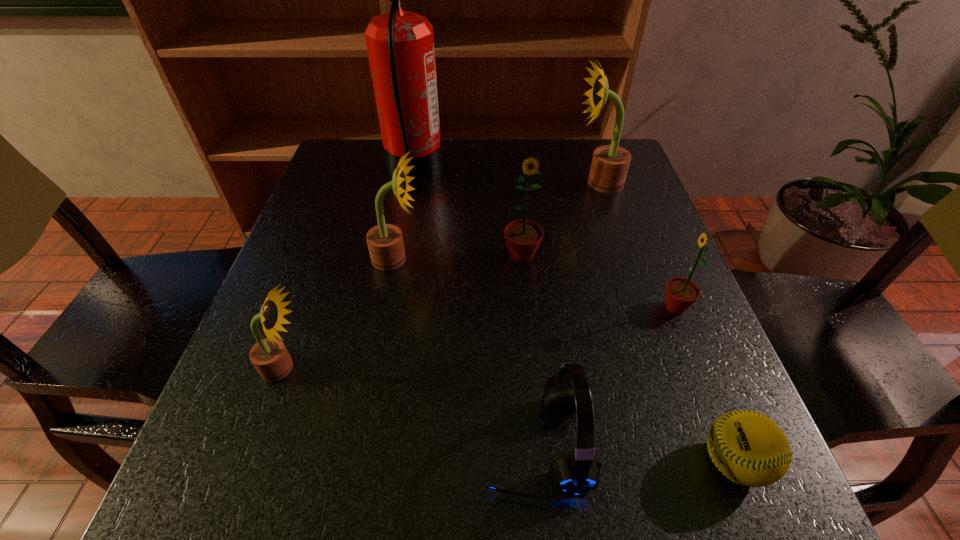
Where is `fire extinguisher`? Image resolution: width=960 pixels, height=540 pixels. fire extinguisher is located at coordinates (400, 44).

Locate an element on the screen. Image resolution: width=960 pixels, height=540 pixels. black fire extinguisher is located at coordinates (400, 44).

This screenshot has width=960, height=540. I want to click on the farthest yellow sunflower, so click(x=610, y=163).

Identify the location of the tallest sunflower. Image resolution: width=960 pixels, height=540 pixels. (610, 163).

Where is `the second biggest yellow sunflower`? the second biggest yellow sunflower is located at coordinates (385, 243).

Identify the location of the second farthest yellow sunflower. (385, 243).

Identify the location of the third sunflower from right to left. The height and width of the screenshot is (540, 960). (523, 237).

Where is `the farther green sunflower`? the farther green sunflower is located at coordinates [523, 237].

Find the location of a particular element. The width and height of the screenshot is (960, 540). the nearest yellow sunflower is located at coordinates (269, 356).

Identify the location of the leftmost object. This screenshot has width=960, height=540. (269, 356).